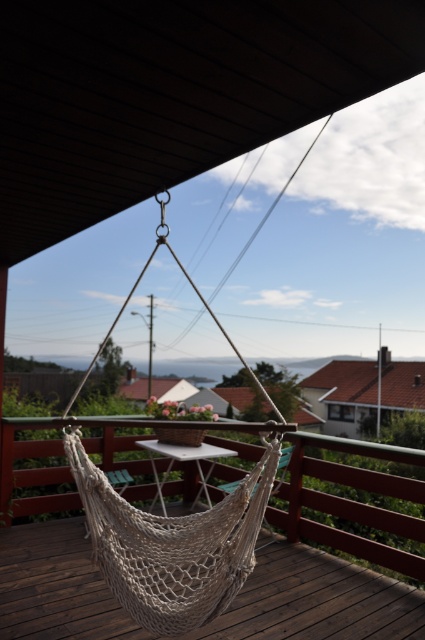
You are planning to lie down on the hammock. Which hammock should you choose if you want to avoid direct sunlight? Please select between the white rope hammock at center and the white mesh hammock at center.

The white mesh hammock at center is positioned above the white rope hammock at center. Since the mesh hammock is above, it likely provides shade, so you should choose the white mesh hammock at center to avoid direct sunlight.

You are planning to set up a new hammock in your backyard and have two options from the image. The white rope hammock at center and the white mesh hammock at center. Which one takes up more space when hung?

The white mesh hammock at center takes up more space than the white rope hammock at center because the white rope hammock at center occupies less space than white mesh hammock at center.